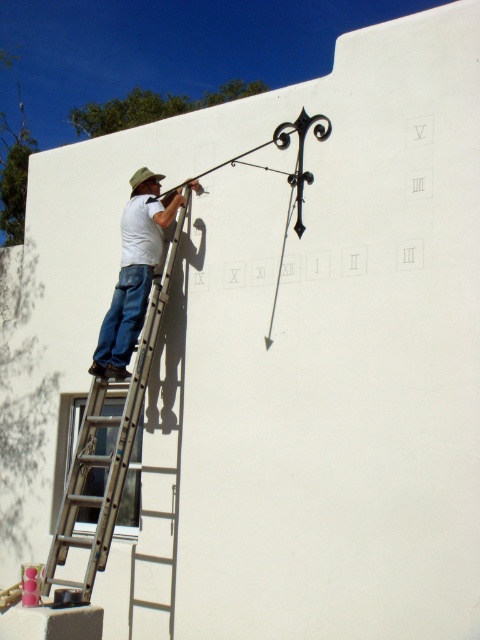
Question: Does silver metallic ladder at left have a greater width compared to white matte shirt at upper left?

Choices:
 (A) yes
 (B) no

Answer: (A)

Question: Can you confirm if silver metallic ladder at left is wider than white matte shirt at upper left?

Choices:
 (A) no
 (B) yes

Answer: (B)

Question: Which of the following is the farthest from the observer?

Choices:
 (A) white matte shirt at upper left
 (B) silver metallic ladder at left

Answer: (A)

Question: Which point is closer to the camera taking this photo?

Choices:
 (A) (164, 211)
 (B) (110, 424)

Answer: (B)

Question: From the image, what is the correct spatial relationship of silver metallic ladder at left in relation to white matte shirt at upper left?

Choices:
 (A) below
 (B) above

Answer: (A)